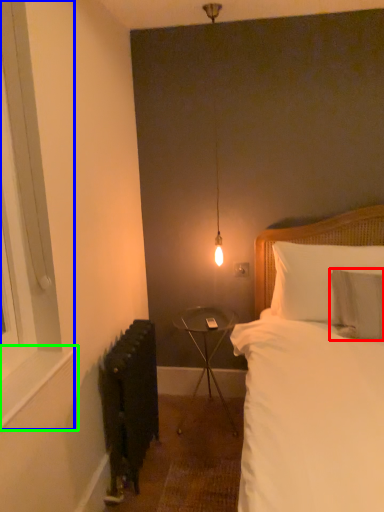
Question: Which is nearer to the pillow (highlighted by a red box)? window (highlighted by a blue box) or window sill (highlighted by a green box).

Choices:
 (A) window
 (B) window sill

Answer: (B)